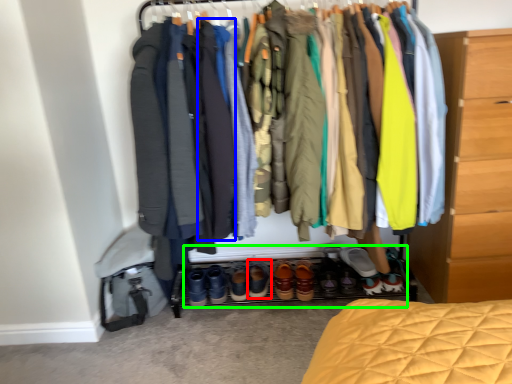
Question: Which is farther away from footwear (highlighted by a red box)? robe (highlighted by a blue box) or footwear (highlighted by a green box)?

Choices:
 (A) robe
 (B) footwear

Answer: (A)